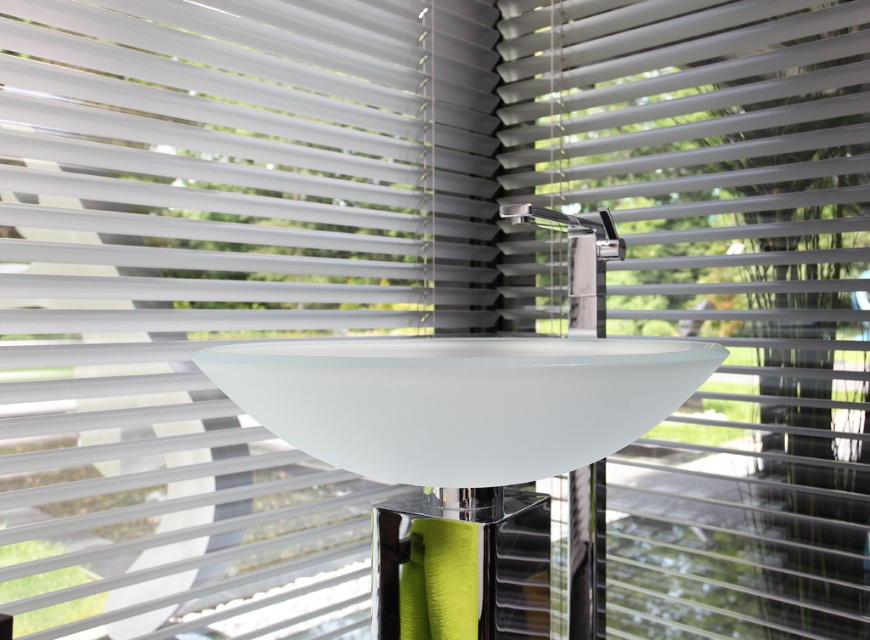
Between frosted glass sink at center and polished chrome faucet at center, which one is positioned lower?

frosted glass sink at center is below.

Based on the photo, who is higher up, frosted glass sink at center or polished chrome faucet at center?

polished chrome faucet at center is higher up.

What do you see at coordinates (459, 401) in the screenshot?
I see `frosted glass sink at center` at bounding box center [459, 401].

Where is `frosted glass sink at center`? The width and height of the screenshot is (870, 640). frosted glass sink at center is located at coordinates (459, 401).

Consider the image. Measure the distance between point [795,349] and camera.

A distance of 26.07 inches exists between point [795,349] and camera.

Which is more to the right, white matte blind at center or polished chrome faucet at center?

white matte blind at center

Where is `white matte blind at center`? The width and height of the screenshot is (870, 640). white matte blind at center is located at coordinates (720, 289).

Can you confirm if white matte blind at center is positioned to the right of frosted glass sink at center?

Correct, you'll find white matte blind at center to the right of frosted glass sink at center.

Is point (693, 84) closer to camera compared to point (365, 468)?

That is False.

At what (x,y) coordinates should I click in order to perform the action: click on white matte blind at center. Please return your answer as a coordinate pair (x, y). Looking at the image, I should click on (720, 289).